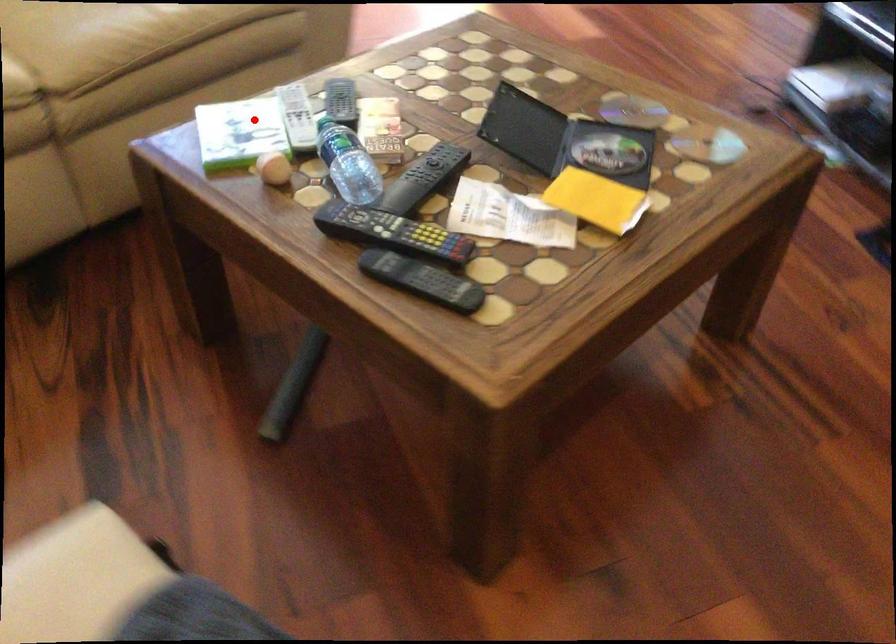
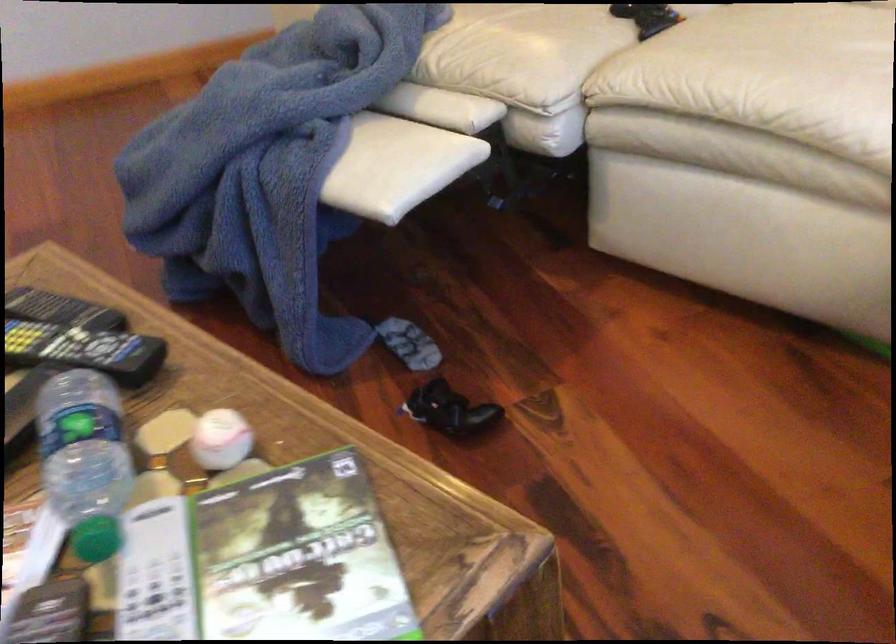
Question: I am providing you with two images of the same scene from different viewpoints. A red point is shown in image1. For the corresponding object point in image2, is it positioned nearer or farther from the camera?

Choices:
 (A) Nearer
 (B) Farther

Answer: (A)